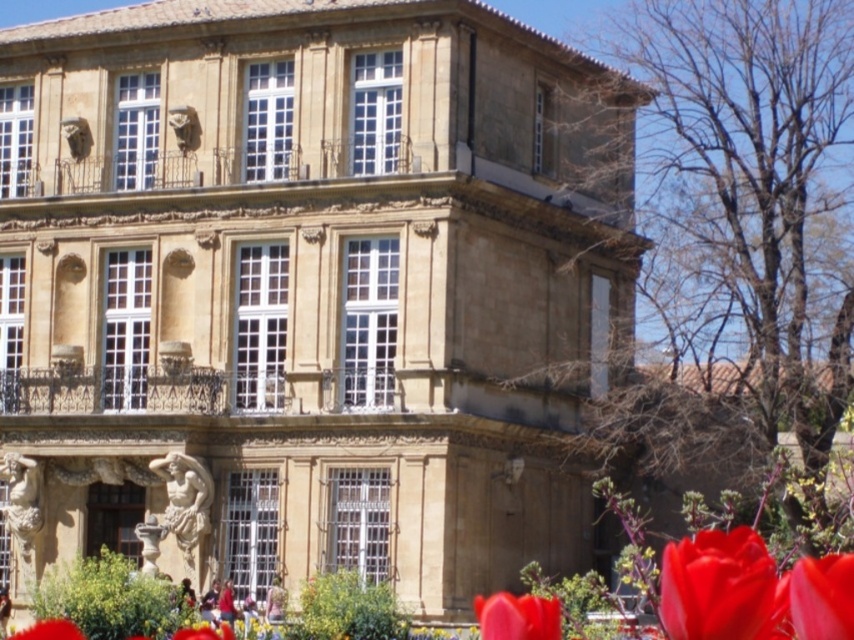
Question: In this image, where is smooth glossy red flower at lower right located relative to glossy red tulip at lower right?

Choices:
 (A) right
 (B) left

Answer: (A)

Question: Which of the following is the farthest from the observer?

Choices:
 (A) (676, 627)
 (B) (483, 636)
 (C) (34, 625)
 (D) (188, 636)

Answer: (C)

Question: Which point is closer to the camera?

Choices:
 (A) (554, 600)
 (B) (775, 573)
 (C) (20, 632)
 (D) (829, 596)

Answer: (D)

Question: Is smooth glossy red flower at lower right to the left of smooth red petal at lower left from the viewer's perspective?

Choices:
 (A) no
 (B) yes

Answer: (A)

Question: Is smooth glossy red flower at lower right above vivid red petal at lower right?

Choices:
 (A) no
 (B) yes

Answer: (A)

Question: Among these objects, which one is nearest to the camera?

Choices:
 (A) glossy red tulip at lower right
 (B) smooth red petal at lower center
 (C) vivid red petal at lower right
 (D) smooth red petal at lower left

Answer: (C)